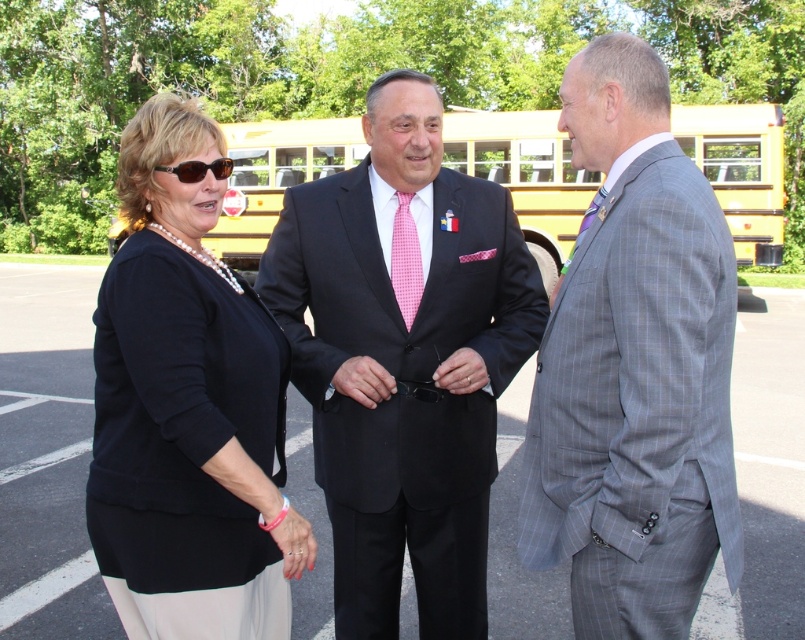
Question: Is black matte cardigan at left positioned before yellow painted bus at center?

Choices:
 (A) yes
 (B) no

Answer: (A)

Question: Which point is farther from the camera taking this photo?

Choices:
 (A) (217, 353)
 (B) (318, 449)

Answer: (B)

Question: Where is matte black suit at center located in relation to black plastic sunglasses at upper left in the image?

Choices:
 (A) below
 (B) above

Answer: (A)

Question: Is gray checkered suit at right closer to camera compared to black matte cardigan at left?

Choices:
 (A) yes
 (B) no

Answer: (A)

Question: Which point appears farthest from the camera in this image?

Choices:
 (A) (225, 170)
 (B) (704, 109)
 (C) (597, 428)

Answer: (B)

Question: Which point is closer to the camera?

Choices:
 (A) (716, 192)
 (B) (197, 561)

Answer: (B)